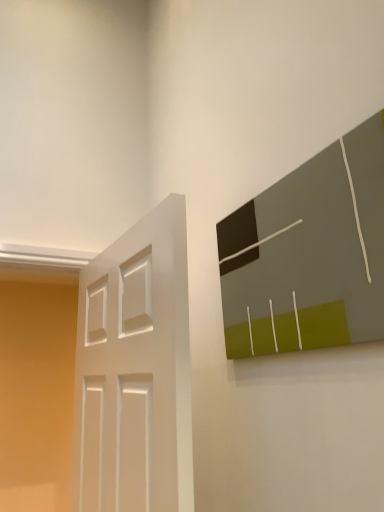
Image resolution: width=384 pixels, height=512 pixels. I want to click on matte gray bulletin board at upper right, so click(309, 254).

Looking at this image, measure the distance between matte gray bulletin board at upper right and camera.

They are 29.00 inches apart.

The width and height of the screenshot is (384, 512). Describe the element at coordinates (309, 254) in the screenshot. I see `matte gray bulletin board at upper right` at that location.

Where is `matte gray bulletin board at upper right`? The image size is (384, 512). matte gray bulletin board at upper right is located at coordinates (309, 254).